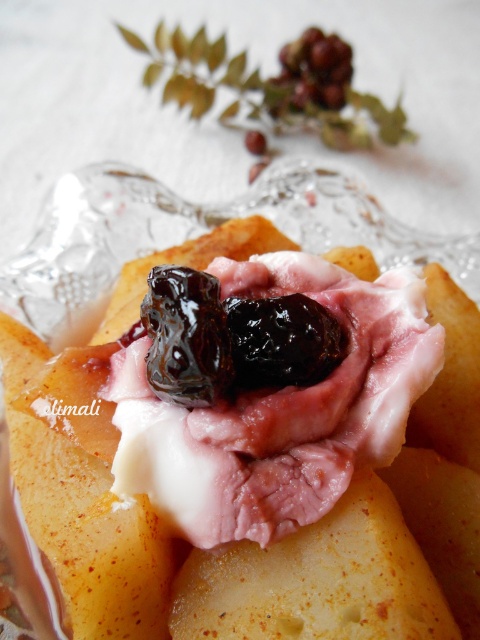
You are a food critic analyzing the placement of ingredients on a dessert dish. The dish has a decorative glass plate with a floral design. You need to determine the exact coordinates of the pink creamy ham at center. What are its coordinates?

The pink creamy ham at center is located at coordinates point (x=256, y=448).

You are a food critic who needs to describe the arrangement of the dark glossy plum at center and the ripe purple grapes at upper center in the dessert dish. How far apart are they?

The dark glossy plum at center is 33.59 inches away from the ripe purple grapes at upper center.

You are a food photographer trying to capture the dessert dish. You want to focus on the point that is closer to the camera. Which point should you choose between point (108, 458) and point (339, 60)?

Point (108, 458) is closer to the camera than point (339, 60), so you should focus on point (108, 458).